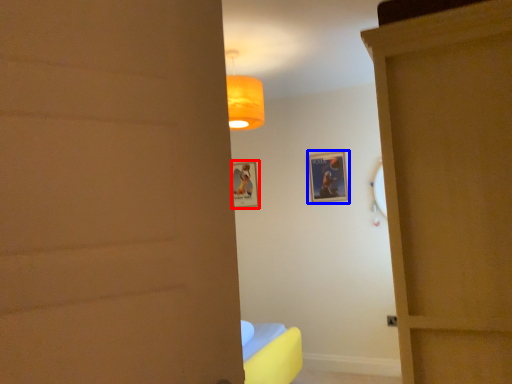
Question: Which object appears closest to the camera in this image, picture frame (highlighted by a red box) or picture frame (highlighted by a blue box)?

Choices:
 (A) picture frame
 (B) picture frame

Answer: (B)